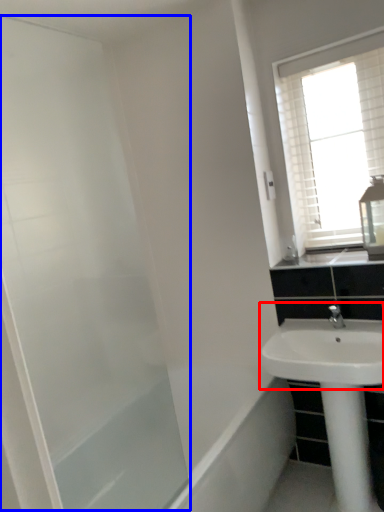
Question: Which object appears closest to the camera in this image, sink (highlighted by a red box) or screen door (highlighted by a blue box)?

Choices:
 (A) sink
 (B) screen door

Answer: (B)